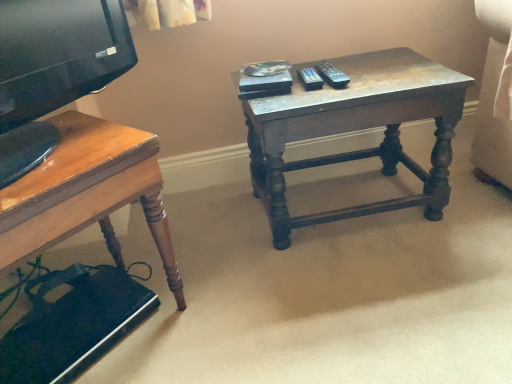
Identify the location of free space to the left of distressed wood table at center. pyautogui.click(x=221, y=236).